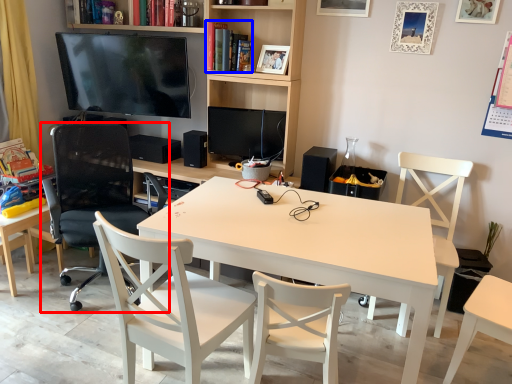
Question: Among these objects, which one is nearest to the camera, chair (highlighted by a red box) or book (highlighted by a blue box)?

Choices:
 (A) chair
 (B) book

Answer: (A)